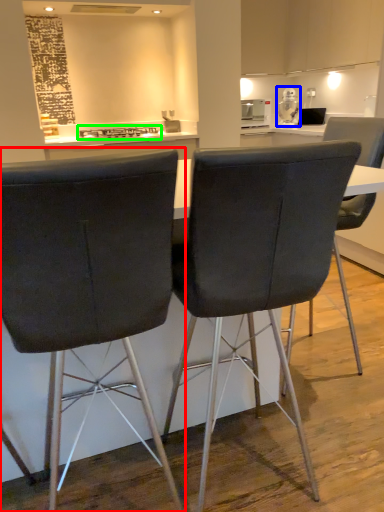
Question: Considering the real-world distances, which object is farthest from chair (highlighted by a red box)? appliance (highlighted by a blue box) or stove (highlighted by a green box)?

Choices:
 (A) appliance
 (B) stove

Answer: (A)